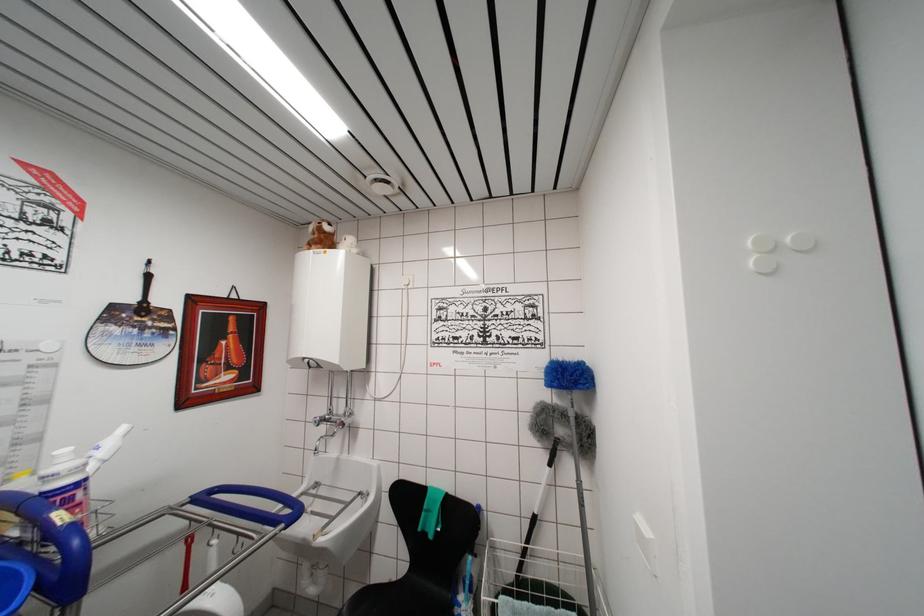
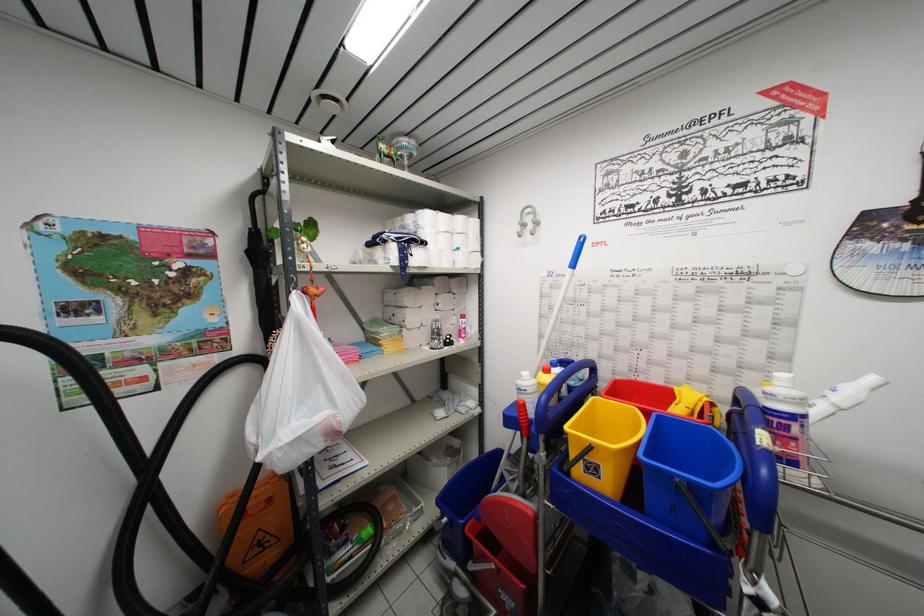
In the second image, find the point that corresponds to point 66,504 in the first image.

(783, 428)